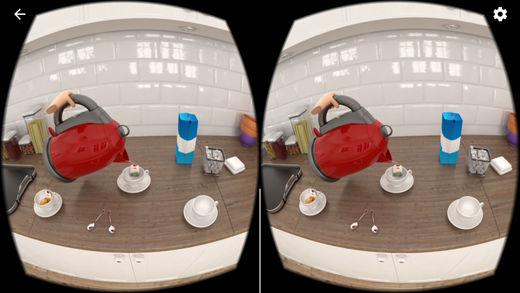
I want to click on floor, so click(x=300, y=267), click(x=166, y=283).